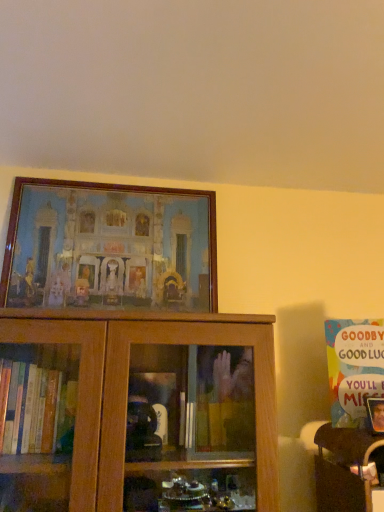
In order to face wooden table at lower right, should I rotate leftwards or rightwards?

Rotate right and turn 21.323 degrees.

Locate an element on the screen. This screenshot has width=384, height=512. multicolored paper card at upper right is located at coordinates (354, 368).

Can you confirm if wooden picture frame at upper center is bigger than wooden table at lower right?

Indeed, wooden picture frame at upper center has a larger size compared to wooden table at lower right.

Identify the location of furniture that is under the wooden picture frame at upper center (from a real-world perspective). The image size is (384, 512). (344, 468).

Considering the sizes of objects wooden picture frame at upper center and wooden table at lower right in the image provided, who is wider, wooden picture frame at upper center or wooden table at lower right?

Wider between the two is wooden table at lower right.

Would you say wooden picture frame at upper center is inside or outside wooden table at lower right?

wooden picture frame at upper center exists outside the volume of wooden table at lower right.

How distant is wooden picture frame at upper center from multicolored paper card at upper right?

wooden picture frame at upper center is 27.04 inches away from multicolored paper card at upper right.

Is wooden picture frame at upper center facing towards multicolored paper card at upper right?

No, wooden picture frame at upper center is not aimed at multicolored paper card at upper right.

Is wooden picture frame at upper center to the right of multicolored paper card at upper right from the viewer's perspective?

In fact, wooden picture frame at upper center is to the left of multicolored paper card at upper right.

Is there a large distance between wooden picture frame at upper center and multicolored paper card at upper right?

No, there isn't a large distance between wooden picture frame at upper center and multicolored paper card at upper right.

What's the angular difference between wooden table at lower right and multicolored paper card at upper right's facing directions?

The angular difference between wooden table at lower right and multicolored paper card at upper right is 25.1 degrees.

You are a GUI agent. You are given a task and a screenshot of the screen. Output one action in this format:
    pyautogui.click(x=<x>, y=<y>)
    Task: Click on the book that is on the right side of wooden table at lower right
    This screenshot has width=384, height=512.
    Given the screenshot: What is the action you would take?
    pyautogui.click(x=354, y=368)

From a real-world perspective, is wooden table at lower right physically below multicolored paper card at upper right?

Correct, in the physical world, wooden table at lower right is lower than multicolored paper card at upper right.

From the image's perspective, between wooden table at lower right and multicolored paper card at upper right, who is located below?

wooden table at lower right is shown below in the image.

Is wooden table at lower right further to the viewer compared to wooden picture frame at upper center?

No, wooden table at lower right is closer to the viewer.

From the image's perspective, which is above, wooden table at lower right or wooden picture frame at upper center?

wooden picture frame at upper center, from the image's perspective.

Identify the location of furniture in front of the wooden picture frame at upper center. The image size is (384, 512). [x=344, y=468].

What's the angular difference between wooden table at lower right and wooden picture frame at upper center's facing directions?

wooden table at lower right and wooden picture frame at upper center are facing 0.933 degrees away from each other.

Considering the sizes of objects multicolored paper card at upper right and wooden picture frame at upper center in the image provided, who is bigger, multicolored paper card at upper right or wooden picture frame at upper center?

Bigger between the two is wooden picture frame at upper center.

Is multicolored paper card at upper right not near wooden picture frame at upper center?

No, multicolored paper card at upper right is in close proximity to wooden picture frame at upper center.

Is wooden picture frame at upper center completely or partially inside multicolored paper card at upper right?

No.

The image size is (384, 512). I want to click on picture frame behind the multicolored paper card at upper right, so click(110, 247).

Is multicolored paper card at upper right facing towards wooden table at lower right?

No, multicolored paper card at upper right is not oriented towards wooden table at lower right.

Consider the image. From a real-world perspective, is multicolored paper card at upper right below wooden table at lower right?

Incorrect, from a real-world perspective, multicolored paper card at upper right is higher than wooden table at lower right.

Considering the positions of objects multicolored paper card at upper right and wooden table at lower right in the image provided, who is more to the right, multicolored paper card at upper right or wooden table at lower right?

multicolored paper card at upper right is more to the right.

You are a GUI agent. You are given a task and a screenshot of the screen. Output one action in this format:
    pyautogui.click(x=<x>, y=<y>)
    Task: Click on the furniture below the wooden picture frame at upper center (from a real-world perspective)
    
    Given the screenshot: What is the action you would take?
    click(x=344, y=468)

In order to click on book below the wooden picture frame at upper center (from the image's perspective) in this screenshot , I will do `click(354, 368)`.

From the picture: When comparing their distances from multicolored paper card at upper right, does wooden picture frame at upper center or wooden table at lower right seem closer?

The object closer to multicolored paper card at upper right is wooden table at lower right.

Looking at the image, which one is located closer to wooden picture frame at upper center, wooden table at lower right or multicolored paper card at upper right?

multicolored paper card at upper right.

Consider the image. From the image, which object appears to be nearer to multicolored paper card at upper right, wooden table at lower right or wooden picture frame at upper center?

wooden table at lower right.

From the picture: Looking at the image, which one is located further to wooden table at lower right, wooden picture frame at upper center or multicolored paper card at upper right?

wooden picture frame at upper center lies further to wooden table at lower right than the other object.

When comparing their distances from wooden table at lower right, does multicolored paper card at upper right or wooden picture frame at upper center seem closer?

multicolored paper card at upper right is positioned closer to the anchor wooden table at lower right.

Looking at the image, which one is located closer to wooden picture frame at upper center, multicolored paper card at upper right or wooden table at lower right?

Based on the image, multicolored paper card at upper right appears to be nearer to wooden picture frame at upper center.

Locate an element on the screen. furniture situated between wooden picture frame at upper center and multicolored paper card at upper right from left to right is located at coordinates (344, 468).